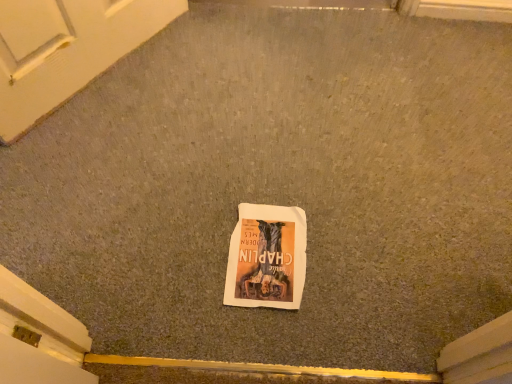
Identify the location of vacant area located to the right-hand side of white paper at center. (349, 255).